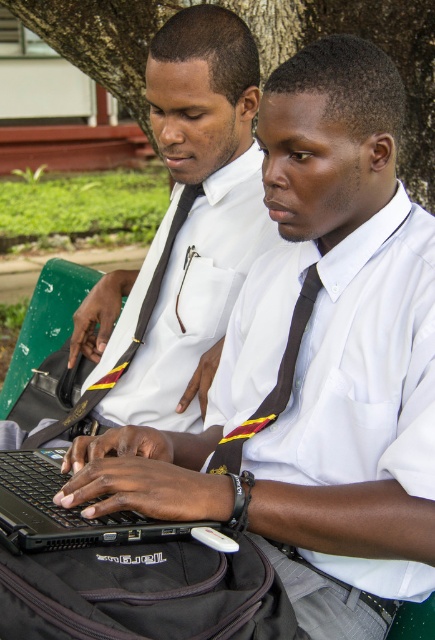
You are a photographer trying to capture a clear shot of the black satin tie at left and the black satin tie at center. Since both are in the frame, can you tell which one is closer to the camera?

The black satin tie at center is behind the black satin tie at left, so the black satin tie at left is closer to the camera.

You are a photographer trying to capture a photo of both black satin ties in the scene. Since you want both ties to be visible in the frame, which direction should you move your camera to ensure both the black satin tie at left and the black satin tie at center are fully visible?

You should move your camera to the right so that both the black satin tie at left and the black satin tie at center are fully visible in the frame.

You are a photographer trying to capture a clear photo of the black satin tie at center without the matte black laptop at center blocking it. What should you do?

Move the camera position to the side so that the black satin tie at center is no longer behind the matte black laptop at center, since the matte black laptop at center is closer to the viewer than the black satin tie at center.